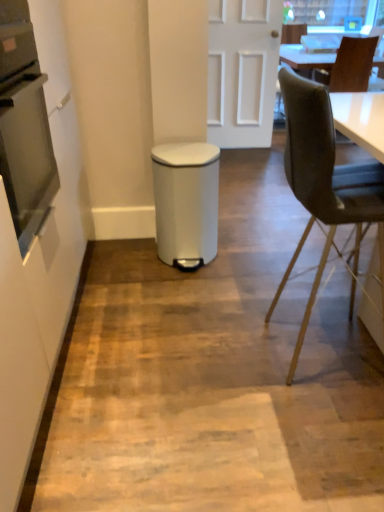
Question: Is white matte door at center to the right of brown leather chair at upper right, which appears as the 1th chair when viewed from the top, from the viewer's perspective?

Choices:
 (A) no
 (B) yes

Answer: (A)

Question: Is white matte door at center facing towards brown leather chair at upper right, which appears as the 1th chair when viewed from the top?

Choices:
 (A) yes
 (B) no

Answer: (B)

Question: Is white matte door at center thinner than brown leather chair at upper right, acting as the 1th chair starting from the back?

Choices:
 (A) yes
 (B) no

Answer: (A)

Question: Is white matte door at center closer to camera compared to brown leather chair at upper right, placed as the second chair when sorted from front to back?

Choices:
 (A) no
 (B) yes

Answer: (B)

Question: Is white matte door at center beside brown leather chair at upper right, placed as the second chair when sorted from bottom to top?

Choices:
 (A) yes
 (B) no

Answer: (B)

Question: Is white matte door at center taller than brown leather chair at upper right, placed as the 2th chair when sorted from left to right?

Choices:
 (A) no
 (B) yes

Answer: (B)

Question: Is velvet black chair at right, which appears as the 1th chair when viewed from the left, surrounded by stainless steel oven at left?

Choices:
 (A) yes
 (B) no

Answer: (B)

Question: Can you confirm if stainless steel oven at left is shorter than velvet black chair at right, acting as the 2th chair starting from the top?

Choices:
 (A) yes
 (B) no

Answer: (A)

Question: Is stainless steel oven at left to the left of velvet black chair at right, positioned as the first chair in bottom-to-top order, from the viewer's perspective?

Choices:
 (A) yes
 (B) no

Answer: (A)

Question: Considering the relative sizes of stainless steel oven at left and velvet black chair at right, placed as the second chair when sorted from right to left, in the image provided, is stainless steel oven at left taller than velvet black chair at right, placed as the second chair when sorted from right to left,?

Choices:
 (A) yes
 (B) no

Answer: (B)

Question: Could you tell me if stainless steel oven at left is facing velvet black chair at right, which appears as the 1th chair when viewed from the left?

Choices:
 (A) no
 (B) yes

Answer: (B)

Question: Does stainless steel oven at left appear on the right side of velvet black chair at right, which appears as the 1th chair when viewed from the left?

Choices:
 (A) no
 (B) yes

Answer: (A)

Question: From a real-world perspective, is stainless steel oven at left below white matte door at center?

Choices:
 (A) yes
 (B) no

Answer: (B)